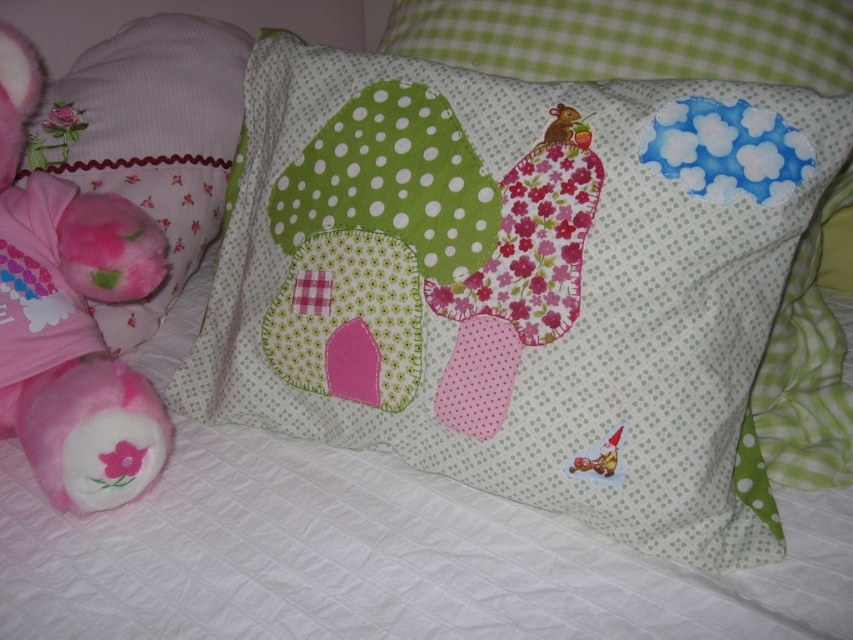
You are standing 91.47 centimeters away from the point at coordinates point (7, 268). If you want to place a 30 cm wide book on the bed next to the pillow, will there be enough space?

The distance between you and the point is 91.47 centimeters. Since the book is only 30 cm wide, there is sufficient space to place it next to the pillow on the bed.

You are organizing a child birthday party and need to place a small gift box that is 10 cm wide. You have two options on the left side of the image, the fluffy pink plush at left and the pink fabric pillow at left. Which object can the gift box fit next to without overlapping?

The gift box can fit next to the pink fabric pillow at left because the fluffy pink plush at left is larger in size and may not leave enough space.

You are standing 1.10 meters away from a point marked at coordinates (163, 156) in the image. The pillow with the house and various fabric patches is placed on the bed. Can you reach the pillow from your current position without moving closer than 1.10 meters?

The point marked at coordinates (163, 156) is 1.10 meters away from you. Since the pillow is placed on the bed near that point, you can reach it without moving closer than 1.10 meters if your arm length allows.